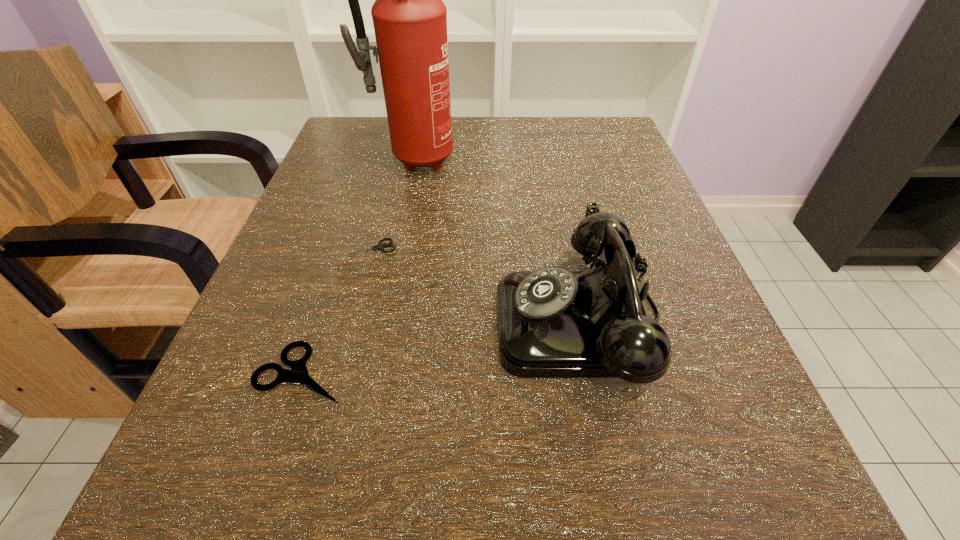
The width and height of the screenshot is (960, 540). In order to click on blank space at the left edge of the desktop in this screenshot , I will do [266, 310].

Find the location of a particular element. Image resolution: width=960 pixels, height=540 pixels. free space at the right edge of the desktop is located at coordinates (697, 285).

Where is `free region at the far right corner of the desktop`? The image size is (960, 540). free region at the far right corner of the desktop is located at coordinates (593, 164).

Identify the location of free space between the farthest object and the shortest object. (389, 204).

The height and width of the screenshot is (540, 960). What are the coordinates of `free space between the farther shears and the farthest object` in the screenshot? It's located at (389, 204).

Locate an element on the screen. Image resolution: width=960 pixels, height=540 pixels. free area in between the shorter shears and the fire extinguisher is located at coordinates (389, 204).

This screenshot has height=540, width=960. In order to click on free space between the farthest object and the third shortest object in this screenshot , I will do `click(495, 239)`.

Identify the location of empty location between the taller shears and the fire extinguisher. (356, 266).

At what (x,y) coordinates should I click in order to perform the action: click on vacant area that lies between the nearer shears and the shortest object. Please return your answer as a coordinate pair (x, y). Image resolution: width=960 pixels, height=540 pixels. Looking at the image, I should click on (335, 311).

Find the location of `unoccupied area between the taller shears and the farther shears`. unoccupied area between the taller shears and the farther shears is located at coordinates (335, 311).